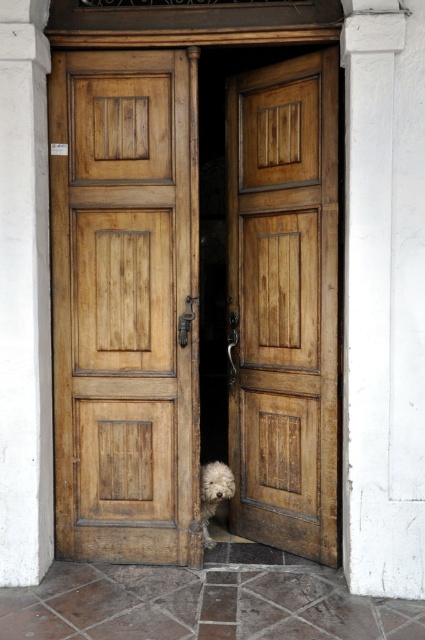
You are standing in front of the light brown wooden door at center and the white smooth pillar at left. Which object is closer to the left side of the scene?

The white smooth pillar at left is closer to the left side of the scene because the light brown wooden door at center is positioned to its right side.

You are standing in front of the double doors and want to know which of the two points, point (342,515) or point (214,464), is closer to you. Can you determine this based on the perspective shown?

Point (342,515) is closer to the viewer than point (214,464).

You are standing in front of the light brown wooden door at center and the white smooth pillar at left. Which object is closer to you?

The light brown wooden door at center is closer to you because it is further to the viewer than the white smooth pillar at left.